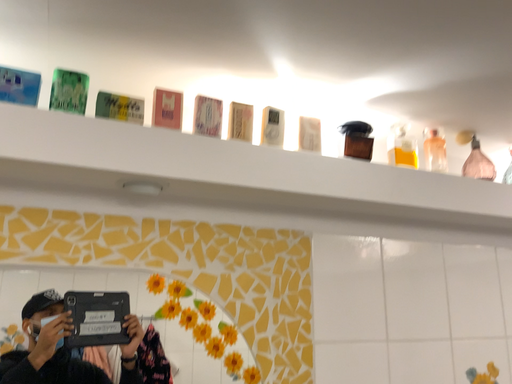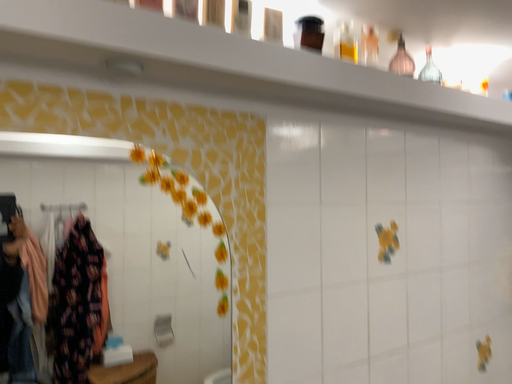
Question: How did the camera likely rotate when shooting the video?

Choices:
 (A) rotated downward
 (B) rotated upward

Answer: (A)